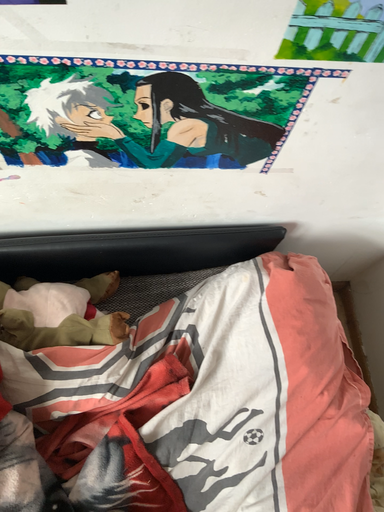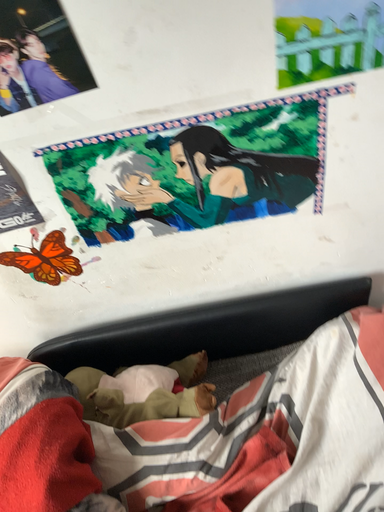
Question: How did the camera likely rotate when shooting the video?

Choices:
 (A) rotated left
 (B) rotated right

Answer: (A)